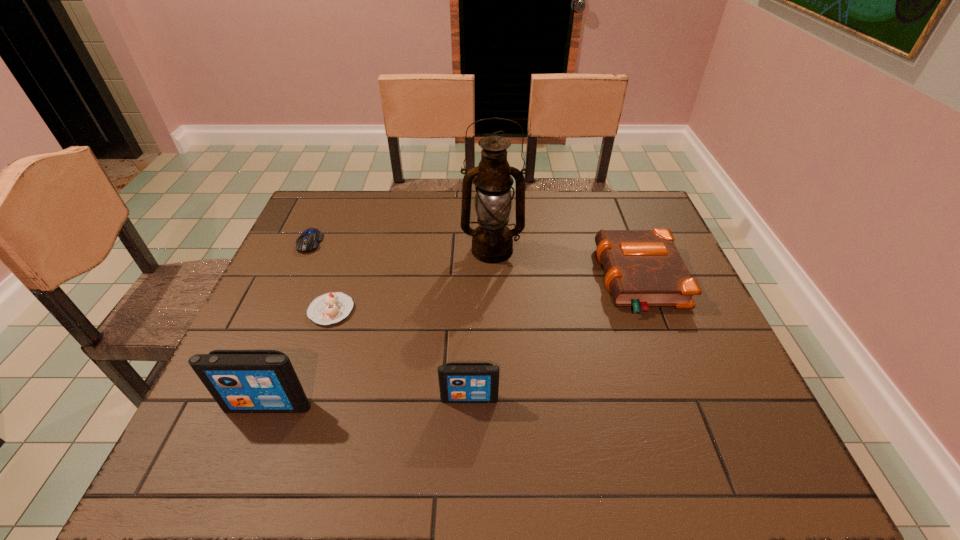
The image size is (960, 540). Identify the location of vacant area that lies between the computer mouse and the oil lamp. (400, 246).

This screenshot has width=960, height=540. What are the coordinates of `blank region between the shortest object and the third shortest object` in the screenshot? It's located at (474, 261).

Where is `free area in between the rightmost object and the shorter iPod`? Image resolution: width=960 pixels, height=540 pixels. free area in between the rightmost object and the shorter iPod is located at coordinates (554, 339).

The image size is (960, 540). Identify the location of vacant area that lies between the rightmost object and the shorter iPod. (554, 339).

Image resolution: width=960 pixels, height=540 pixels. Find the location of `vacant space that is in between the third shortest object and the taller iPod`. vacant space that is in between the third shortest object and the taller iPod is located at coordinates (453, 343).

At what (x,y) coordinates should I click in order to perform the action: click on free space between the oil lamp and the shortest object. Please return your answer as a coordinate pair (x, y). Looking at the image, I should click on (400, 246).

Where is `blank region between the left iPod and the oil lamp`? Image resolution: width=960 pixels, height=540 pixels. blank region between the left iPod and the oil lamp is located at coordinates (380, 328).

Locate an element on the screen. This screenshot has height=540, width=960. object that stands as the third closest to the Bible is located at coordinates (329, 308).

I want to click on object that is the third closest to the rightmost object, so click(329, 308).

You are a GUI agent. You are given a task and a screenshot of the screen. Output one action in this format:
    pyautogui.click(x=<x>, y=<y>)
    Task: Click on the vacant space that satisfies the following two spatial constraints: 1. on the back side of the tallest object; 2. on the left side of the cupcake
    This screenshot has height=540, width=960.
    Given the screenshot: What is the action you would take?
    point(351,251)